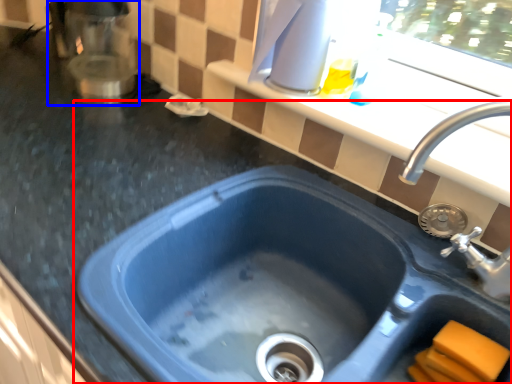
Question: Which object appears closest to the camera in this image, sink (highlighted by a red box) or appliance (highlighted by a blue box)?

Choices:
 (A) sink
 (B) appliance

Answer: (A)